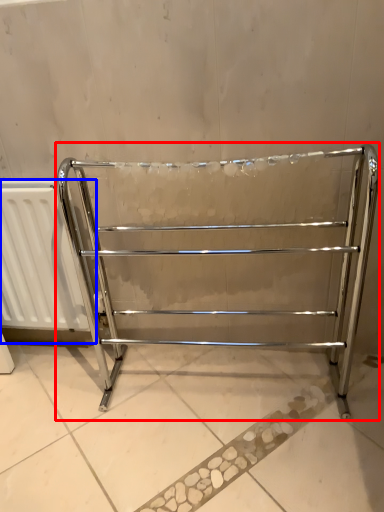
Question: Which of the following is the farthest to the observer, furniture (highlighted by a red box) or radiator (highlighted by a blue box)?

Choices:
 (A) furniture
 (B) radiator

Answer: (B)